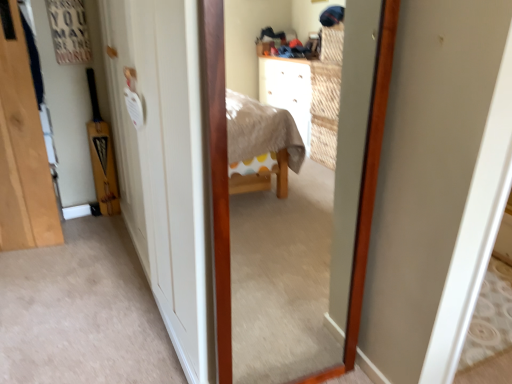
What are the coordinates of `unoccupied space behind wooden mirror at center` in the screenshot? It's located at (282, 350).